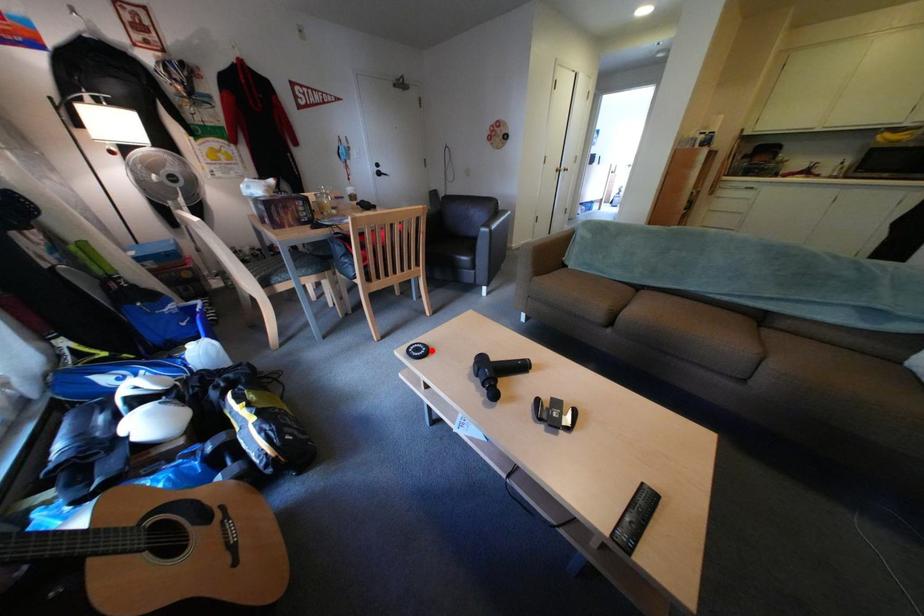
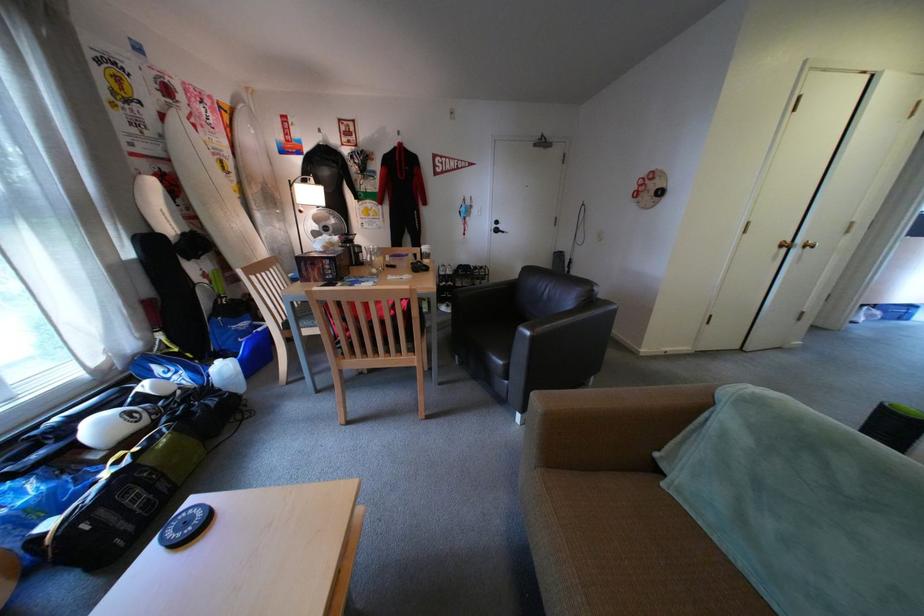
Find the pixel in the second image that matches the highlighted location in the first image.

(199, 525)